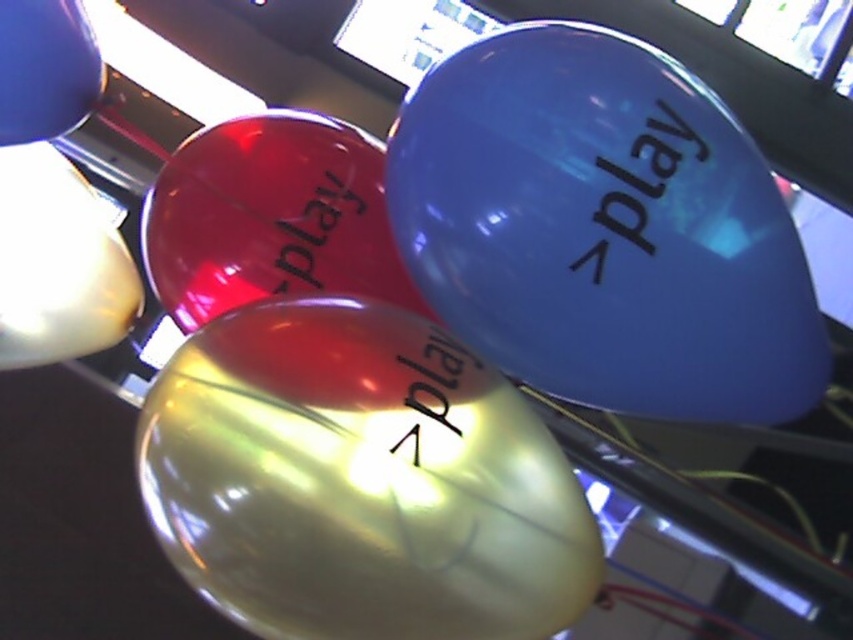
You are setting up decorations for an event and need to ensure that the glossy blue play at upper right and the glossy plastic play at center are arranged properly. According to the image, which object is placed above the other?

The glossy blue play at upper right is positioned over the glossy plastic play at center, meaning it is placed above the other.

You are setting up decorations for an event and need to arrange the balloons in a specific order. You have a glossy blue balloon at upper right and a matte blue balloon at upper left. According to the image, which balloon is positioned to the right of the other?

The glossy blue balloon at upper right is positioned to the right of the matte blue balloon at upper left.